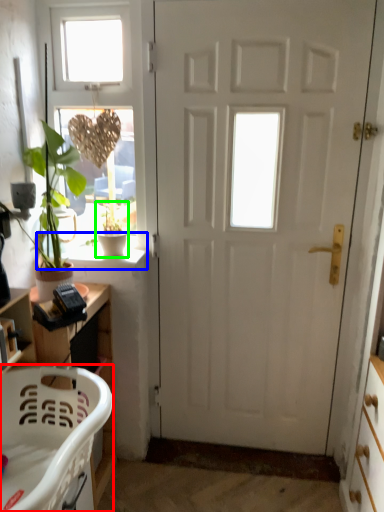
Question: Estimate the real-world distances between objects in this image. Which object is farther from chair (highlighted by a red box), window sill (highlighted by a blue box) or houseplant (highlighted by a green box)?

Choices:
 (A) window sill
 (B) houseplant

Answer: (B)